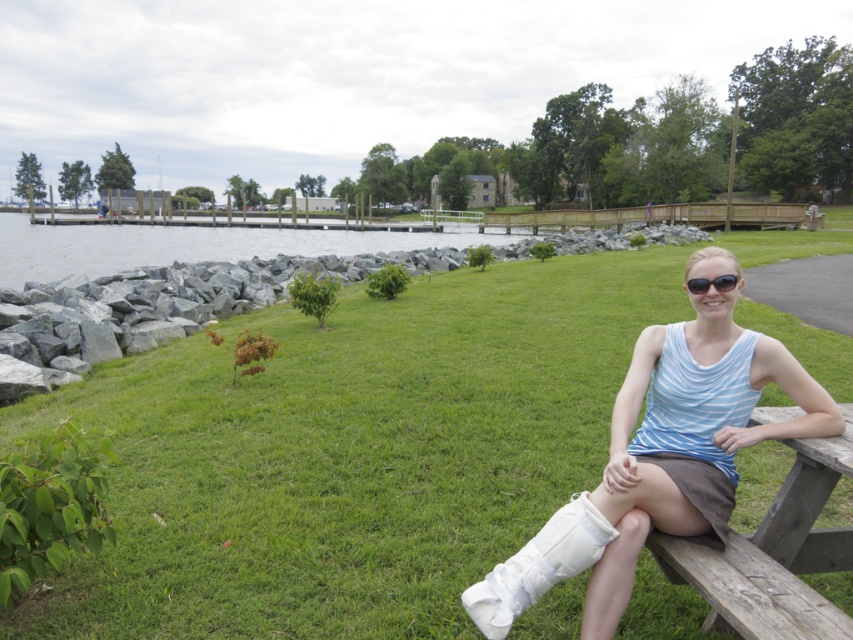
From the picture: Does white matte cast at center appear over gray rock water at center?

No, white matte cast at center is not above gray rock water at center.

This screenshot has width=853, height=640. Identify the location of white matte cast at center. (669, 449).

This screenshot has width=853, height=640. Find the location of `white matte cast at center`. white matte cast at center is located at coordinates (669, 449).

Does wooden park bench at lower right appear on the right side of black plastic sunglasses at upper center?

Yes, wooden park bench at lower right is to the right of black plastic sunglasses at upper center.

Who is more distant from viewer, (x=743, y=545) or (x=735, y=276)?

The point (x=735, y=276) is more distant.

The image size is (853, 640). I want to click on wooden park bench at lower right, so click(775, 554).

Between green grass at center and gray rock water at center, which one appears on the left side from the viewer's perspective?

Positioned to the left is gray rock water at center.

In the scene shown: Is green grass at center above gray rock water at center?

Incorrect, green grass at center is not positioned above gray rock water at center.

In order to click on green grass at center in this screenshot , I will do `click(350, 452)`.

Where is `green grass at center`? This screenshot has width=853, height=640. green grass at center is located at coordinates (350, 452).